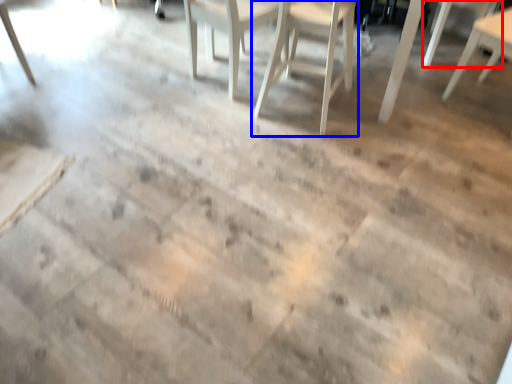
Question: Which object is closer to the camera taking this photo, chair (highlighted by a red box) or chair (highlighted by a blue box)?

Choices:
 (A) chair
 (B) chair

Answer: (B)